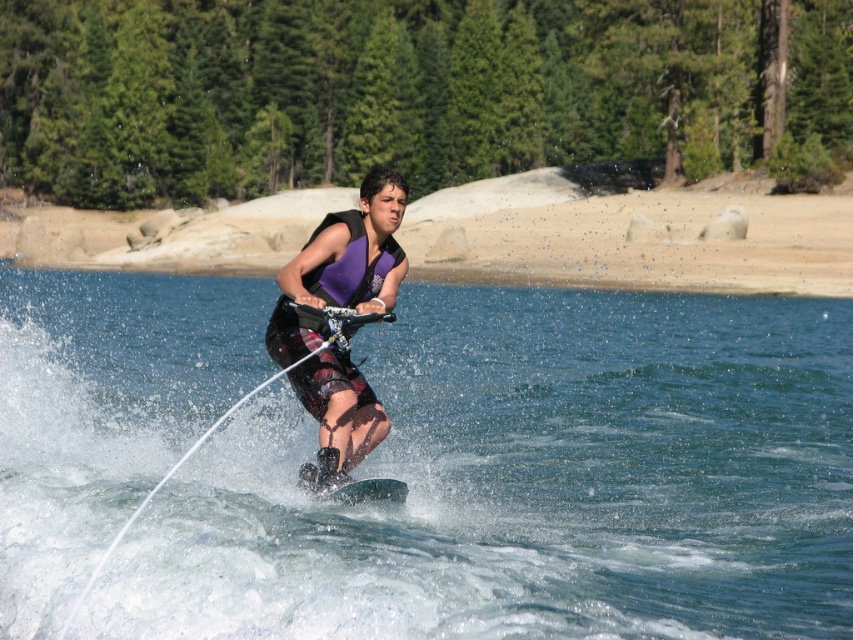
You are a photographer trying to capture the exact location of the clear blue water at center in the image. According to the coordinates provided, where would you focus your camera lens?

The clear blue water at center is located at coordinates point (529,483).

You are a photographer trying to capture the water skier and the surroundings. If you want to include both the green textured tree at upper center and the green smooth board at center in your shot, which object should you pan your camera towards first?

You should pan your camera towards the green textured tree at upper center first because it is positioned to the right of the green smooth board at center, so adjusting the camera to the right will ensure both are in frame.

You are a photographer trying to capture the water skier. You notice the clear blue water at center and the green textured tree at upper center in your viewfinder. Which object should you adjust your camera to focus on if you want to highlight the water skier who is centrally positioned?

The clear blue water at center is to the left of the green textured tree at upper center. To highlight the water skier positioned centrally, focus on the clear blue water at center since it is closer to the skier.